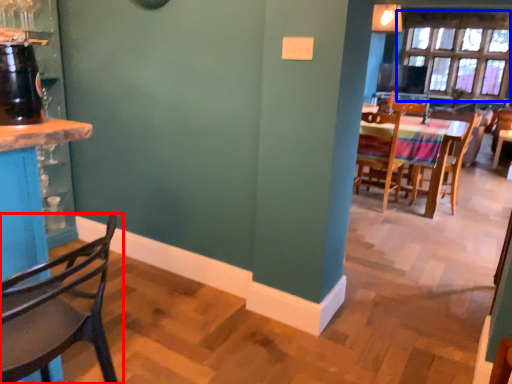
Question: Among these objects, which one is nearest to the camera, chair (highlighted by a red box) or window (highlighted by a blue box)?

Choices:
 (A) chair
 (B) window

Answer: (A)